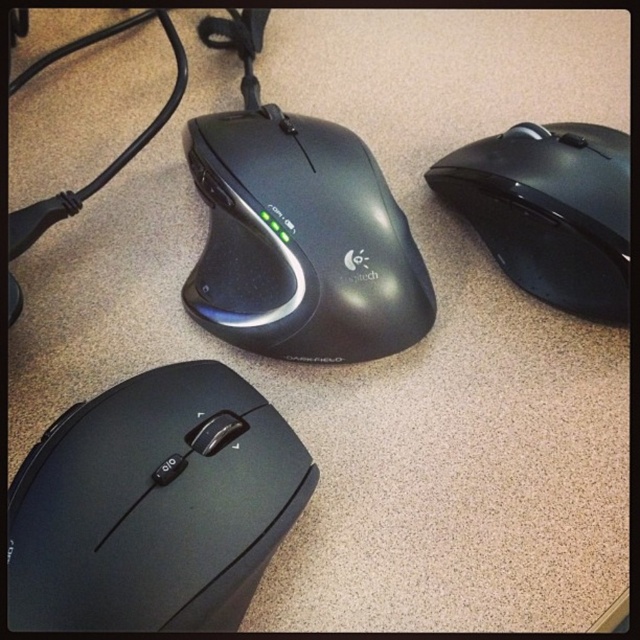
What is the color of the mouse located at point (301, 241)?

The mouse at point (301, 241) is black matte.